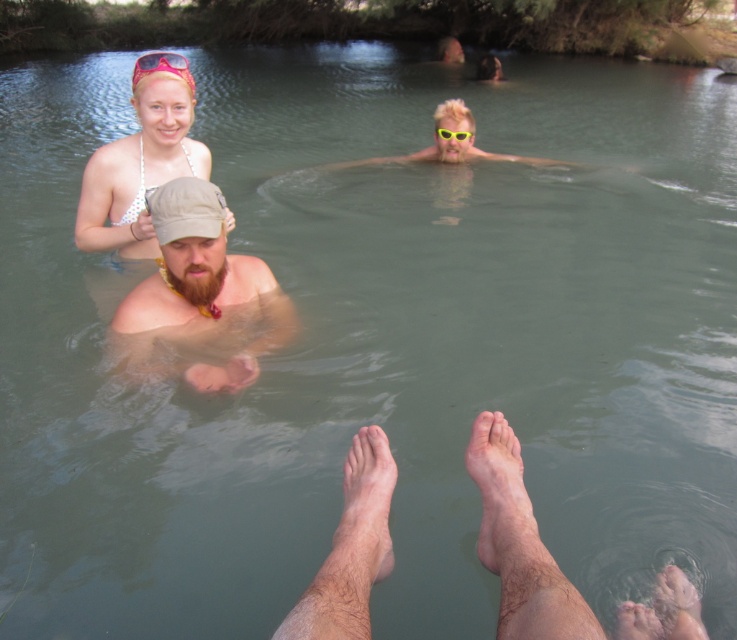
Question: Is dry skin foot at lower center wider than pink plastic goggles at upper center?

Choices:
 (A) yes
 (B) no

Answer: (B)

Question: Which object is positioned farthest from the translucent pink sunglasses at upper center?

Choices:
 (A) pale skin barefoot at center
 (B) dry skin foot at lower center
 (C) white bikini top at upper left
 (D) yellow plastic goggles at upper center

Answer: (D)

Question: Which point is closer to the camera taking this photo?

Choices:
 (A) pyautogui.click(x=654, y=593)
 (B) pyautogui.click(x=511, y=468)
 (C) pyautogui.click(x=147, y=97)
 (D) pyautogui.click(x=181, y=67)

Answer: (B)

Question: Is dry skin foot at lower center below barefoot feet at lower center?

Choices:
 (A) no
 (B) yes

Answer: (A)

Question: Does brown fabric cap at center have a lesser width compared to yellow plastic goggles at upper center?

Choices:
 (A) yes
 (B) no

Answer: (B)

Question: Among these objects, which one is farthest from the camera?

Choices:
 (A) translucent pink sunglasses at upper center
 (B) pink plastic goggles at upper center

Answer: (B)